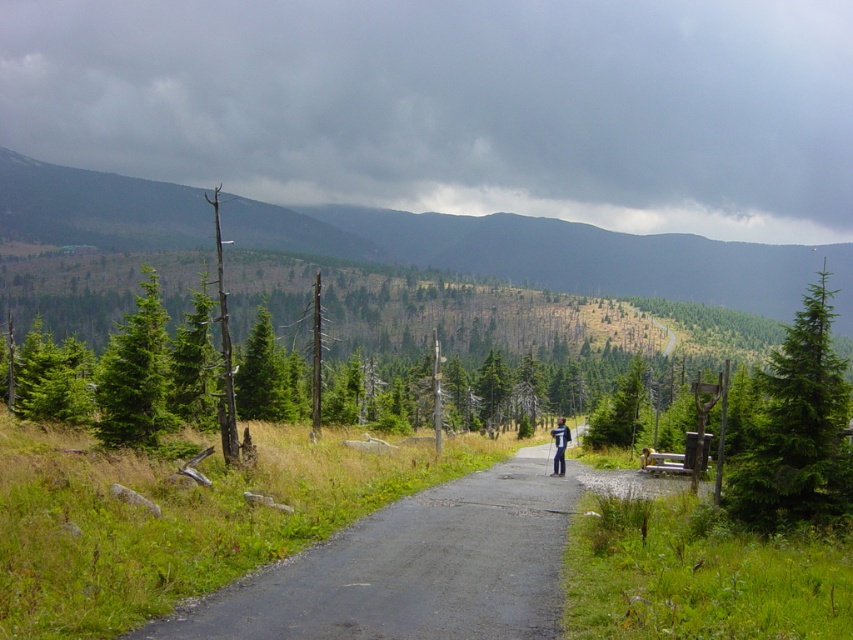
You are a hiker trying to reach the distant winding road. You see the asphalt road at center and the green matte tree at left. Which object is closer to you as you stand at the starting point?

The asphalt road at center is closer to you because it is in front of the green matte tree at left, meaning the tree is further away.

You are a hiker trying to reach the asphalt road at center. You see the green matte tree at right in your path. Can you walk around the tree without leaving the road?

The asphalt road at center is in front of the green matte tree at right, meaning the tree is behind the road. Therefore, you can walk around the tree without leaving the road since it is not blocking your path.